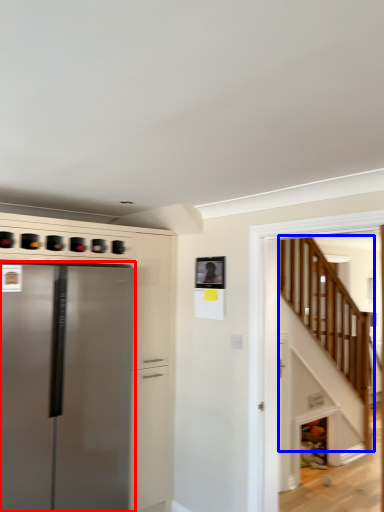
Question: Which of the following is the farthest to the observer, refrigerator (highlighted by a red box) or stairwell (highlighted by a blue box)?

Choices:
 (A) refrigerator
 (B) stairwell

Answer: (A)